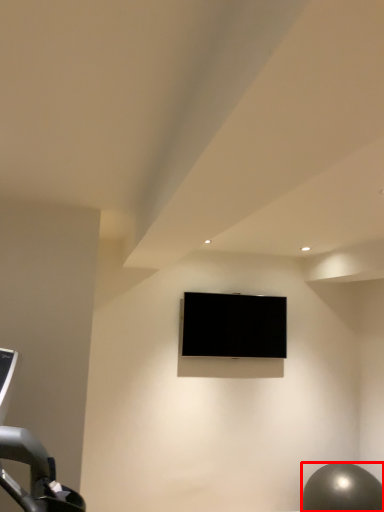
Question: From the image's perspective, what is the correct spatial positioning of ball (annotated by the red box) in reference to television?

Choices:
 (A) below
 (B) above

Answer: (A)